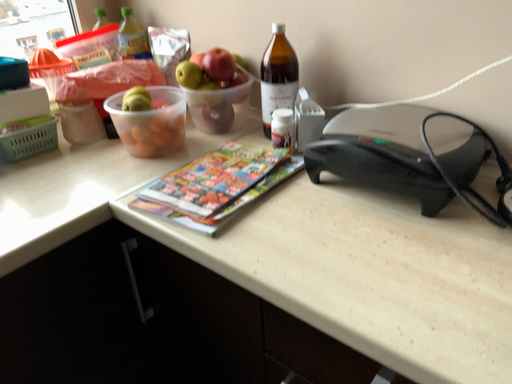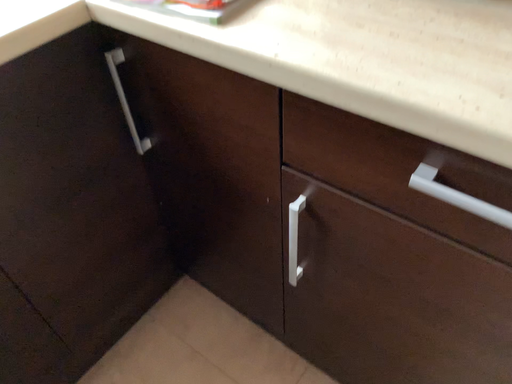
Question: Which way did the camera rotate in the video?

Choices:
 (A) rotated upward
 (B) rotated downward

Answer: (B)